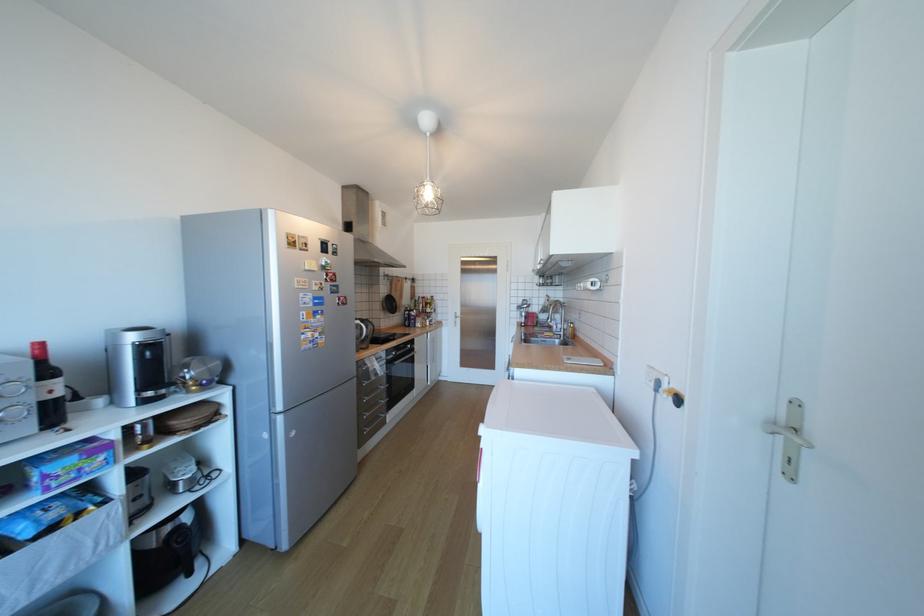
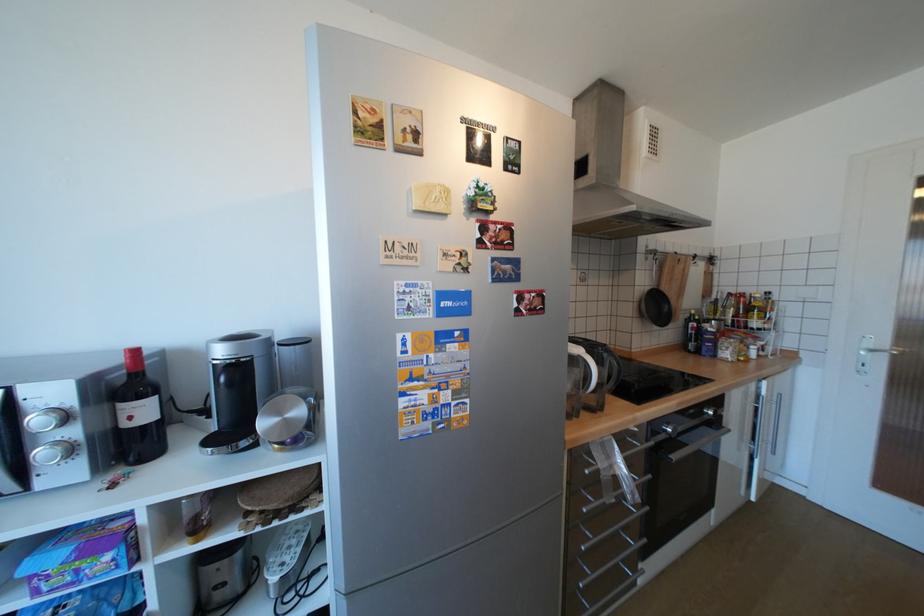
Find the pixel in the second image that matches pixel 203 387 in the first image.

(286, 446)